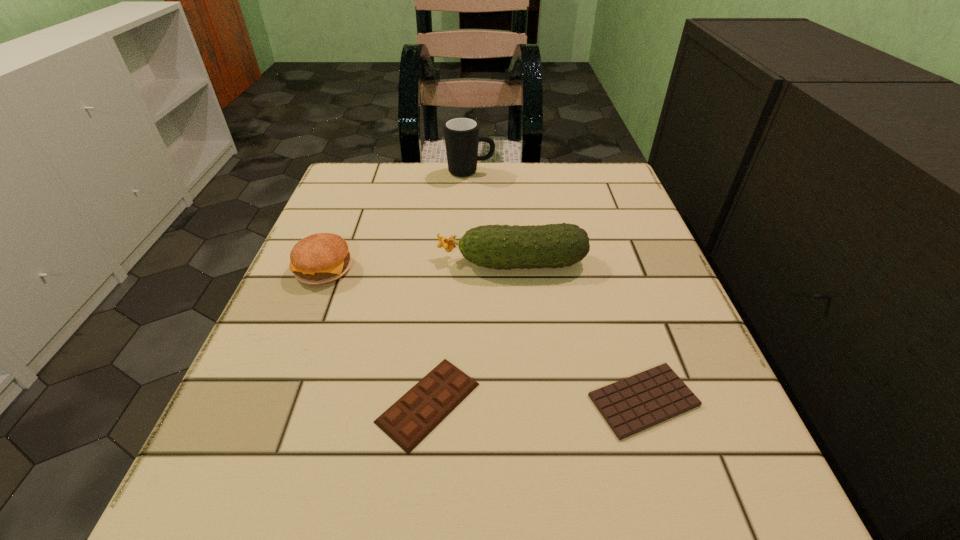
The width and height of the screenshot is (960, 540). Identify the location of mug. (461, 134).

You are a GUI agent. You are given a task and a screenshot of the screen. Output one action in this format:
    pyautogui.click(x=<x>, y=<y>)
    Task: Click on the tallest object
    This screenshot has height=540, width=960.
    Given the screenshot: What is the action you would take?
    pyautogui.click(x=461, y=134)

This screenshot has height=540, width=960. I want to click on the second tallest object, so click(x=506, y=247).

What are the coordinates of `the third tallest object` in the screenshot? It's located at (320, 258).

Locate an element on the screen. The image size is (960, 540). hamburger is located at coordinates (320, 258).

Find the location of a particular element. The height and width of the screenshot is (540, 960). the left chocolate bar is located at coordinates (418, 412).

In order to click on the second shortest object in this screenshot , I will do `click(418, 412)`.

Locate an element on the screen. the right chocolate bar is located at coordinates (631, 405).

You are a GUI agent. You are given a task and a screenshot of the screen. Output one action in this format:
    pyautogui.click(x=<x>, y=<y>)
    Task: Click on the shortest object
    The height and width of the screenshot is (540, 960).
    Given the screenshot: What is the action you would take?
    pyautogui.click(x=631, y=405)

Identify the location of free space located 0.230m on the side of the farthest object with the handle. The width and height of the screenshot is (960, 540). (588, 172).